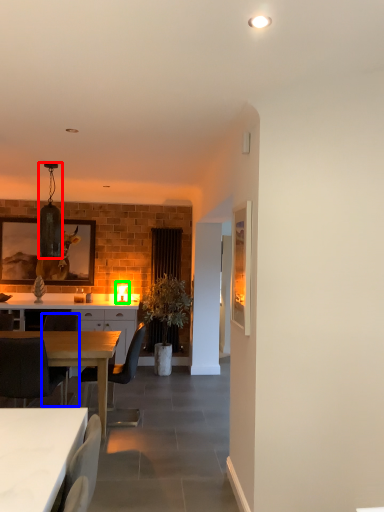
Question: Estimate the real-world distances between objects in this image. Which object is closer to lamp (highlighted by a red box), chair (highlighted by a blue box) or lamp (highlighted by a green box)?

Choices:
 (A) chair
 (B) lamp

Answer: (A)